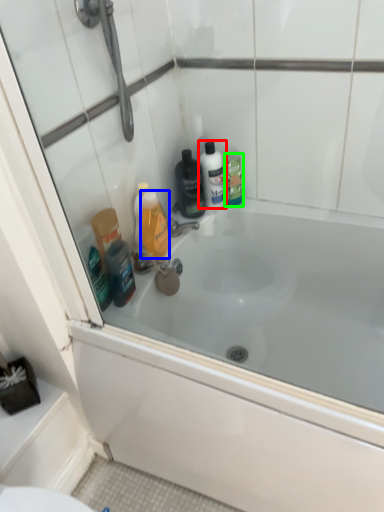
Question: Which object is the closest to the mouthwash (highlighted by a red box)? Choose among these: mouthwash (highlighted by a blue box) or mouthwash (highlighted by a green box).

Choices:
 (A) mouthwash
 (B) mouthwash

Answer: (B)